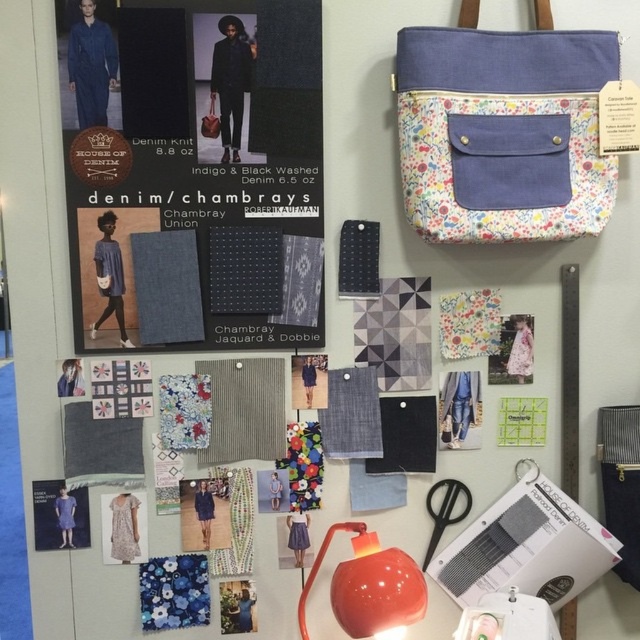
You are organizing a workshop and need to place the orange glossy lamp at lower center and the black plastic scissors at lower center on a shelf. Which object should you place first to ensure stability?

The orange glossy lamp at lower center is taller than the black plastic scissors at lower center. Since taller objects are generally placed at the back or center for stability, you should place the orange glossy lamp at lower center first to ensure it doesn

You are a fashion designer looking at the workspace. You need to know which object is taller between the denim knit at upper left and the floral canvas tote at upper right. Can you tell me which one is taller?

The denim knit at upper left is much taller than the floral canvas tote at upper right according to the description.